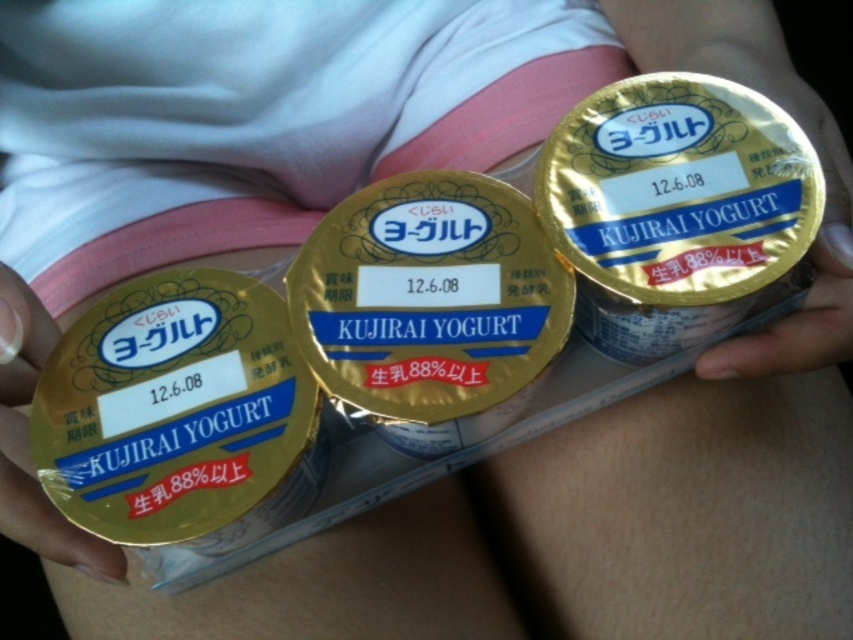
Question: Is the position of metallic gold yogurt container at upper right more distant than that of gold foil yogurt container at center?

Choices:
 (A) no
 (B) yes

Answer: (B)

Question: Is metallic gold yogurt container at upper right bigger than gold foil yogurt container at center?

Choices:
 (A) no
 (B) yes

Answer: (B)

Question: Is metallic gold yogurt container at upper right bigger than gold foil yogurt container at center?

Choices:
 (A) no
 (B) yes

Answer: (B)